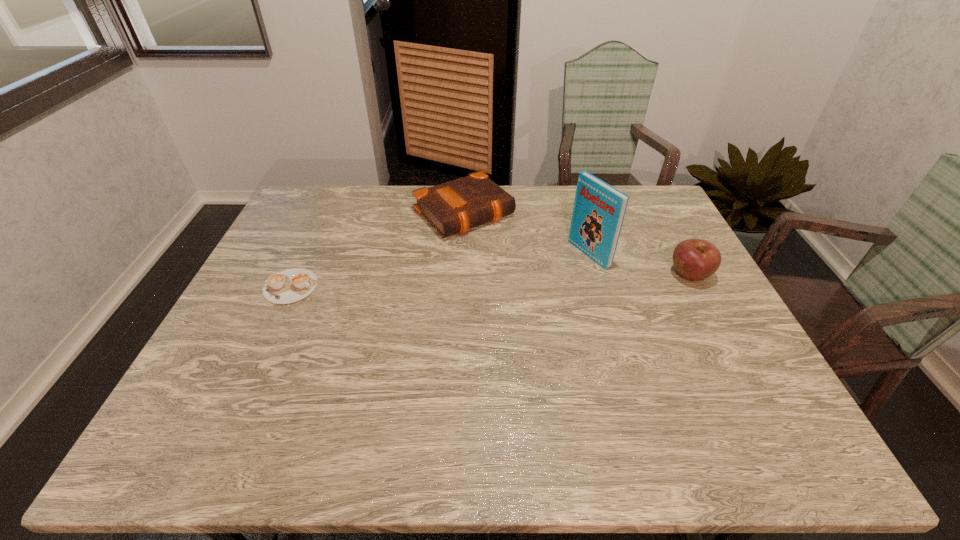
Find the location of a particular element. This screenshot has height=540, width=960. vacant space that is in between the third object from left to right and the second shortest object is located at coordinates (527, 233).

You are a GUI agent. You are given a task and a screenshot of the screen. Output one action in this format:
    pyautogui.click(x=<x>, y=<y>)
    Task: Click on the unoccupied position between the apple and the leftmost object
    This screenshot has height=540, width=960.
    Given the screenshot: What is the action you would take?
    pyautogui.click(x=491, y=281)

Locate an element on the screen. unoccupied position between the book and the leftmost object is located at coordinates (440, 271).

Where is `empty location between the apple and the cappuccino`? Image resolution: width=960 pixels, height=540 pixels. empty location between the apple and the cappuccino is located at coordinates (491, 281).

Find the location of a particular element. Image resolution: width=960 pixels, height=540 pixels. object that stands as the second closest to the tallest object is located at coordinates (694, 259).

Point out which object is positioned as the second nearest to the cappuccino. Please provide its 2D coordinates. Your answer should be formatted as a tuple, i.e. [(x, y)], where the tuple contains the x and y coordinates of a point satisfying the conditions above.

[(599, 209)]

Image resolution: width=960 pixels, height=540 pixels. Find the location of `vacant area in the image that satisfies the following two spatial constraints: 1. on the back side of the cappuccino; 2. on the side of the apple with the unique marking`. vacant area in the image that satisfies the following two spatial constraints: 1. on the back side of the cappuccino; 2. on the side of the apple with the unique marking is located at coordinates (297, 275).